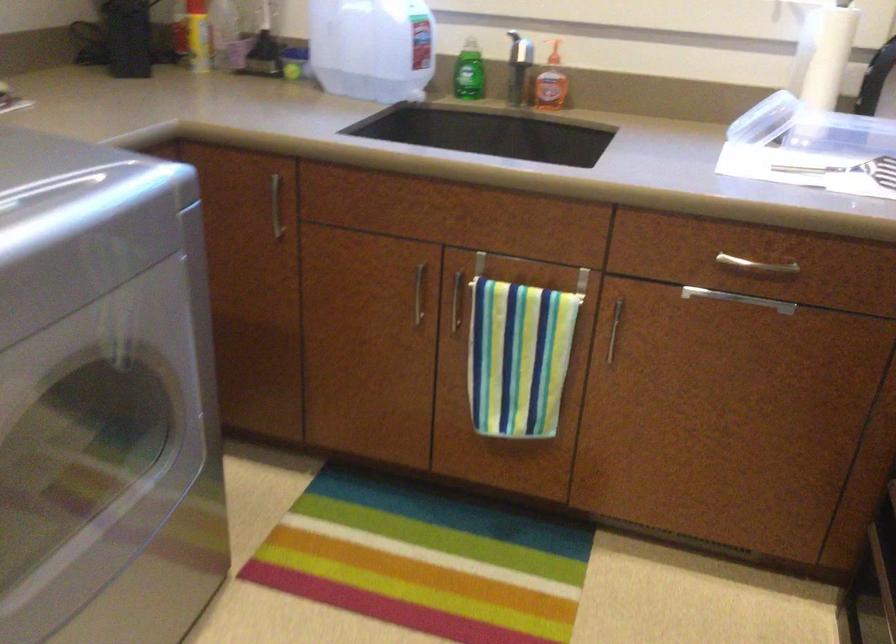
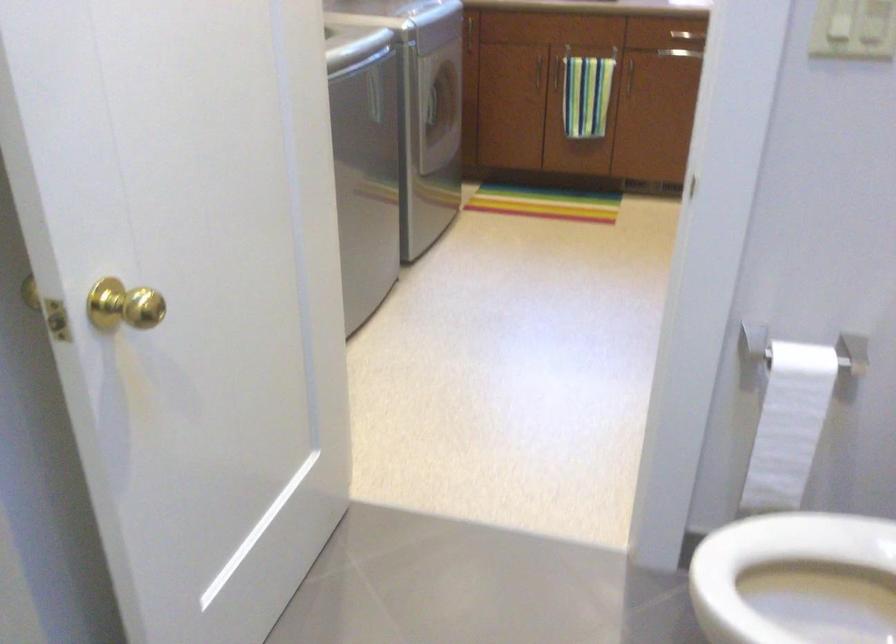
Question: What movement of the cameraman would produce the second image?

Choices:
 (A) Left
 (B) Right
 (C) Forward
 (D) Backward

Answer: (D)